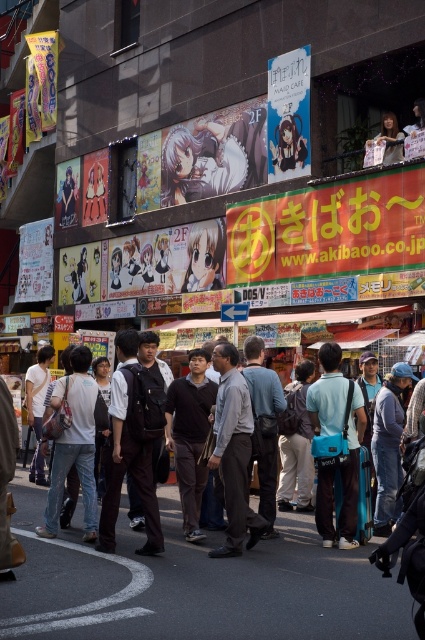
Is dark gray suit at center shorter than dark gray fabric shirt at center?

Indeed, dark gray suit at center has a lesser height compared to dark gray fabric shirt at center.

This screenshot has width=425, height=640. What are the coordinates of `dark gray suit at center` in the screenshot? It's located at (218, 444).

Locate an element on the screen. The height and width of the screenshot is (640, 425). dark gray suit at center is located at coordinates (218, 444).

Does dark gray suit at center have a smaller size compared to teal fabric backpack at center?

No, dark gray suit at center is not smaller than teal fabric backpack at center.

Who is taller, dark gray suit at center or teal fabric backpack at center?

With more height is teal fabric backpack at center.

Describe the element at coordinates (218, 444) in the screenshot. I see `dark gray suit at center` at that location.

Find the location of a particular element. Image resolution: width=425 pixels, height=640 pixels. dark gray suit at center is located at coordinates (218, 444).

Between dark gray fabric shirt at center and teal fabric backpack at center, which one appears on the right side from the viewer's perspective?

From the viewer's perspective, teal fabric backpack at center appears more on the right side.

Between point (244, 442) and point (331, 388), which one is positioned in front?

Point (244, 442)

What do you see at coordinates (234, 452) in the screenshot? I see `dark gray fabric shirt at center` at bounding box center [234, 452].

Image resolution: width=425 pixels, height=640 pixels. In order to click on dark gray fabric shirt at center in this screenshot , I will do `click(234, 452)`.